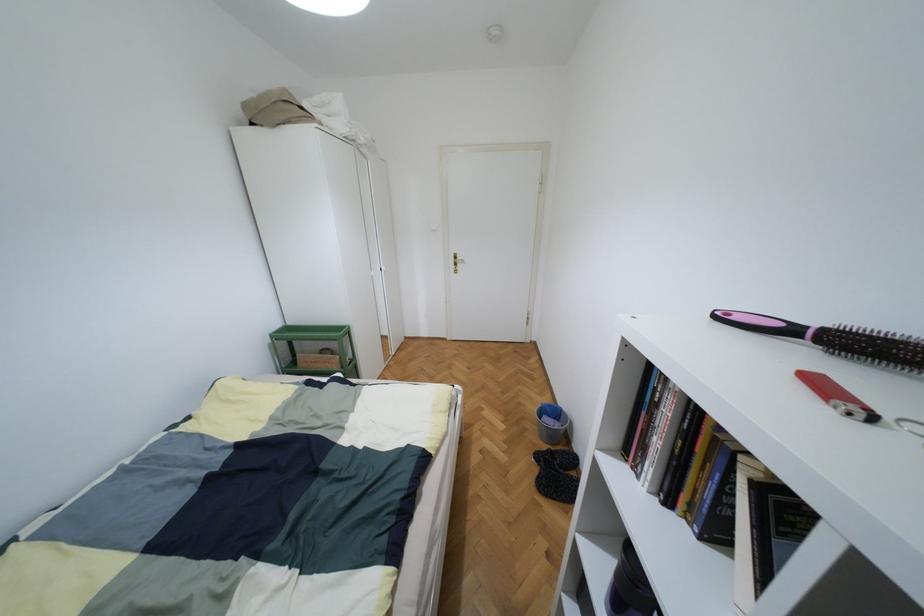
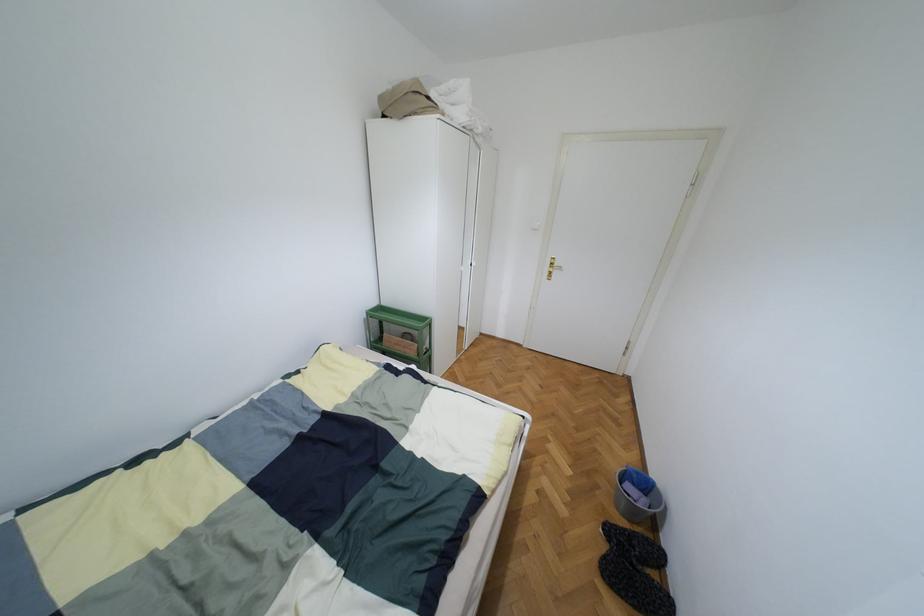
Find the pixel in the second image that matches the point at 540,492 in the first image.

(602, 577)